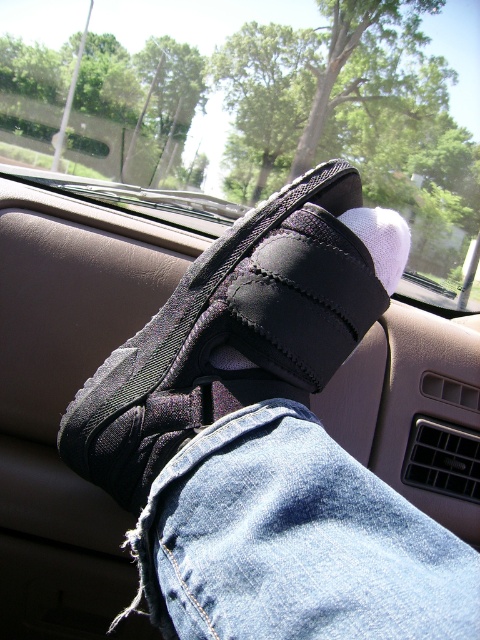
Can you confirm if transparent glass car window at center is smaller than white knitted sock at center?

No, transparent glass car window at center is not smaller than white knitted sock at center.

The image size is (480, 640). What do you see at coordinates (252, 113) in the screenshot? I see `transparent glass car window at center` at bounding box center [252, 113].

Is point (322, 74) in front of point (384, 280)?

No, (322, 74) is further to viewer.

What are the coordinates of `transparent glass car window at center` in the screenshot? It's located at (252, 113).

Does transparent glass car window at center have a larger size compared to denim at center?

Yes, transparent glass car window at center is bigger than denim at center.

Who is taller, transparent glass car window at center or denim at center?

Standing taller between the two is transparent glass car window at center.

Who is more forward, (244, 33) or (211, 632)?

Point (211, 632) is more forward.

You are a GUI agent. You are given a task and a screenshot of the screen. Output one action in this format:
    pyautogui.click(x=<x>, y=<y>)
    Task: Click on the transparent glass car window at center
    
    Given the screenshot: What is the action you would take?
    pyautogui.click(x=252, y=113)

Between transparent glass car window at center and black fabric shoe at center, which one appears on the right side from the viewer's perspective?

Positioned to the right is black fabric shoe at center.

Between point (212, 113) and point (241, 243), which one is positioned behind?

Positioned behind is point (212, 113).

Image resolution: width=480 pixels, height=640 pixels. Describe the element at coordinates (252, 113) in the screenshot. I see `transparent glass car window at center` at that location.

Where is `transparent glass car window at center`? transparent glass car window at center is located at coordinates (252, 113).